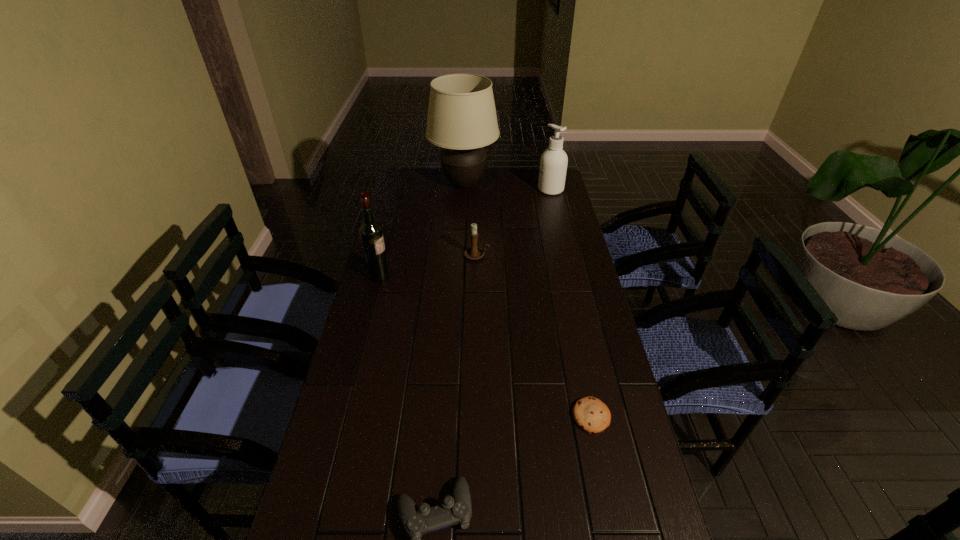
You are a GUI agent. You are given a task and a screenshot of the screen. Output one action in this format:
    pyautogui.click(x=<x>, y=<y>)
    Task: Click on the blank area located 0.230m on the front label of the cleansing agent
    The image size is (960, 540).
    Given the screenshot: What is the action you would take?
    pyautogui.click(x=489, y=190)

Locate an element on the screen. free space located on the front label of the cleansing agent is located at coordinates (451, 190).

This screenshot has height=540, width=960. Identify the location of free location located on the front label of the cleansing agent. (503, 190).

You are a GUI agent. You are given a task and a screenshot of the screen. Output one action in this format:
    pyautogui.click(x=<x>, y=<y>)
    Task: Click on the vacant area situated 0.180m on the side of the fourth nearest object with the handle
    Image resolution: width=960 pixels, height=540 pixels.
    Given the screenshot: What is the action you would take?
    pyautogui.click(x=538, y=255)

Locate an element on the screen. This screenshot has height=540, width=960. free location located on the front of the shortest object is located at coordinates (606, 482).

Locate an element on the screen. lampshade that is at the far edge is located at coordinates (462, 119).

This screenshot has width=960, height=540. Identify the location of cleansing agent present at the far edge. (553, 165).

You are a GUI agent. You are given a task and a screenshot of the screen. Output one action in this format:
    pyautogui.click(x=<x>, y=<y>)
    Task: Click on the lampshade positioned at the left edge
    
    Given the screenshot: What is the action you would take?
    pyautogui.click(x=462, y=119)

You are a GUI agent. You are given a task and a screenshot of the screen. Output one action in this format:
    pyautogui.click(x=<x>, y=<y>)
    Task: Click on the wine bottle present at the left edge
    This screenshot has height=540, width=960.
    Given the screenshot: What is the action you would take?
    pyautogui.click(x=371, y=234)

Where is `cleansing agent that is positioned at the right edge`? cleansing agent that is positioned at the right edge is located at coordinates (553, 165).